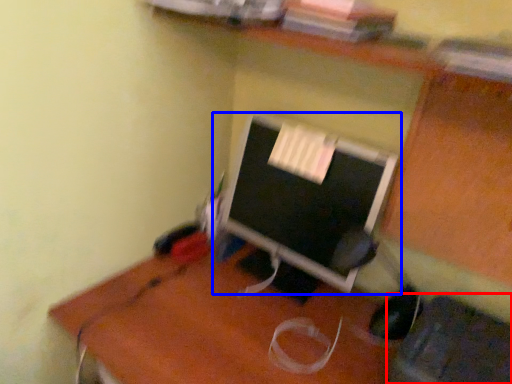
Question: Which of the following is the farthest to the observer, computer chair (highlighted by a red box) or computer monitor (highlighted by a blue box)?

Choices:
 (A) computer chair
 (B) computer monitor

Answer: (B)